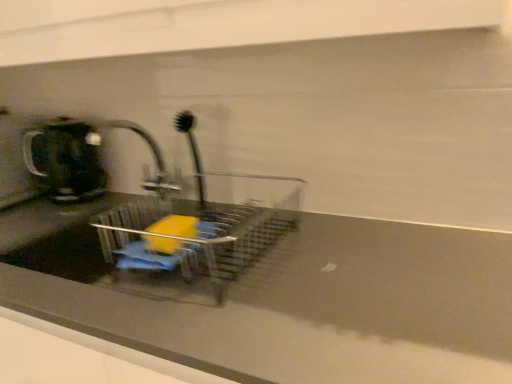
You are a GUI agent. You are given a task and a screenshot of the screen. Output one action in this format:
    pyautogui.click(x=<x>, y=<y>)
    Task: Click on the free space in front of clear plastic sink at center
    The width and height of the screenshot is (512, 384).
    Given the screenshot: What is the action you would take?
    pyautogui.click(x=250, y=326)